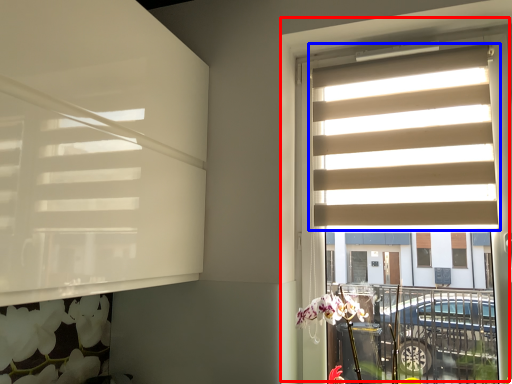
Question: Which of the following is the farthest to the observer, window (highlighted by a red box) or window blind (highlighted by a blue box)?

Choices:
 (A) window
 (B) window blind

Answer: (B)